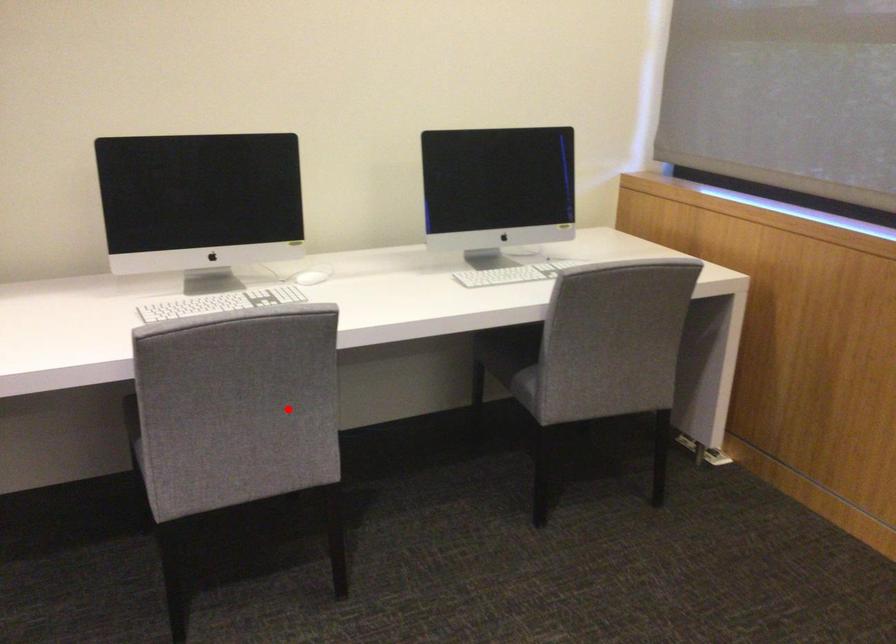
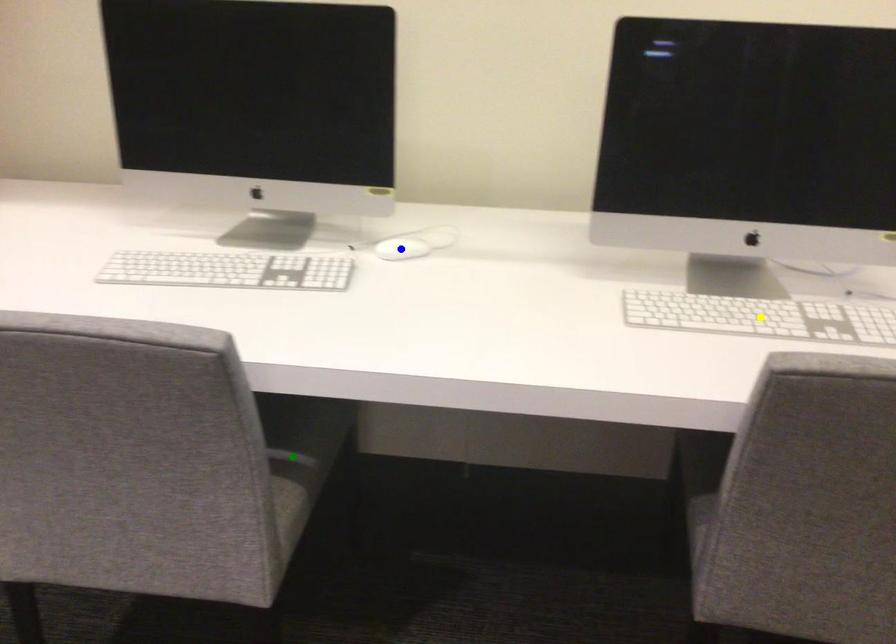
Question: I am providing you with two images of the same scene from different viewpoints. A red point is marked on the first image. You are given multiple points on the second image. Which mark in image 2 goes with the point in image 1?

Choices:
 (A) yellow point
 (B) blue point
 (C) green point

Answer: (C)